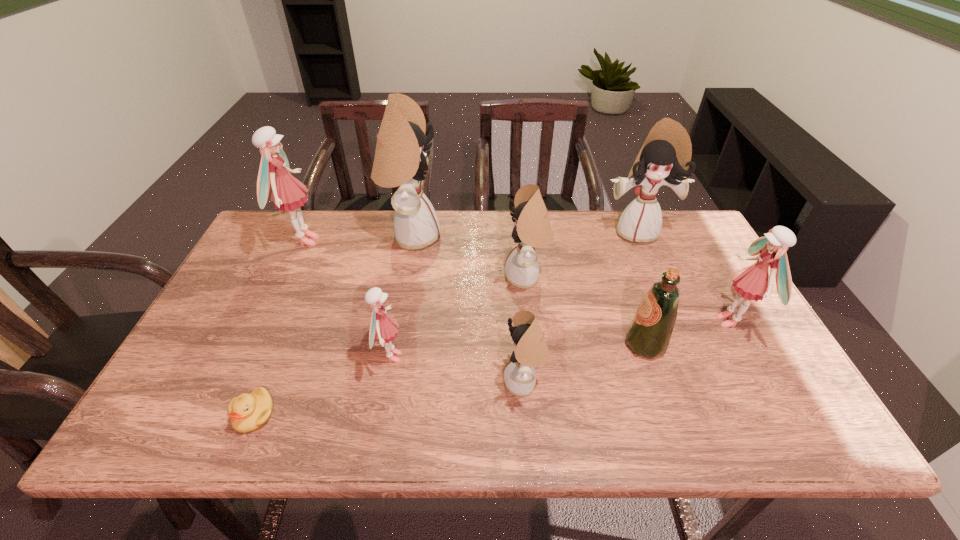
Locate an element on the screen. The height and width of the screenshot is (540, 960). vacant space at the near right corner is located at coordinates (782, 416).

Image resolution: width=960 pixels, height=540 pixels. In order to click on vacant space that's between the nearest black doll and the leftmost doll in this screenshot , I will do `click(414, 312)`.

Identify the location of free space between the yellow duckling and the second biggest pink doll. (492, 368).

This screenshot has height=540, width=960. I want to click on free spot between the second biggest pink doll and the second pink doll from right to left, so click(561, 339).

This screenshot has width=960, height=540. I want to click on free spot between the tallest doll and the rightmost pink doll, so click(x=571, y=279).

At what (x,y) coordinates should I click in order to perform the action: click on free space between the smallest black doll and the olive oil. Please return your answer as a coordinate pair (x, y). The image size is (960, 540). Looking at the image, I should click on (585, 364).

Image resolution: width=960 pixels, height=540 pixels. I want to click on vacant area that lies between the green olive oil and the yellow duckling, so click(449, 380).

At what (x,y) coordinates should I click in order to perform the action: click on vacant space in between the second biggest black doll and the second biggest pink doll. Please return your answer as a coordinate pair (x, y). Image resolution: width=960 pixels, height=540 pixels. Looking at the image, I should click on (684, 276).

The height and width of the screenshot is (540, 960). I want to click on vacant space that is in between the second smallest pink doll and the third biggest black doll, so click(x=629, y=299).

Find the location of `object that can be found as the third closest to the second smallest black doll`. object that can be found as the third closest to the second smallest black doll is located at coordinates (665, 156).